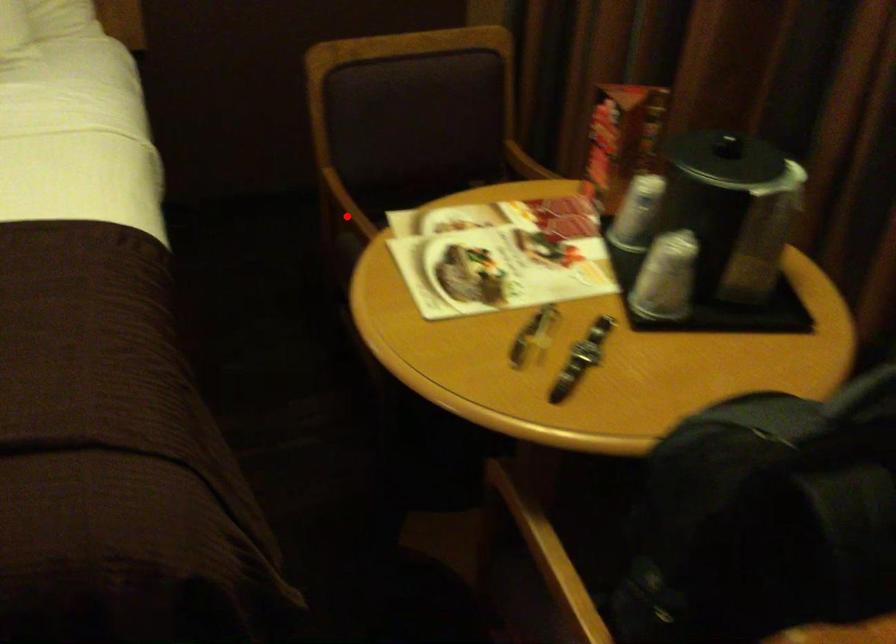
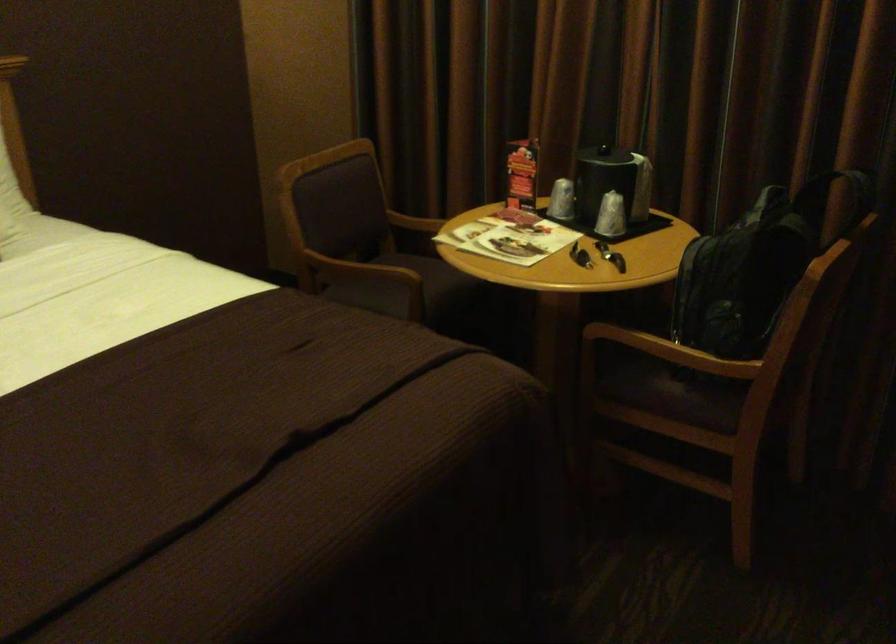
Locate, in the second image, the point that corresponds to the highlighted location in the first image.

(349, 268)